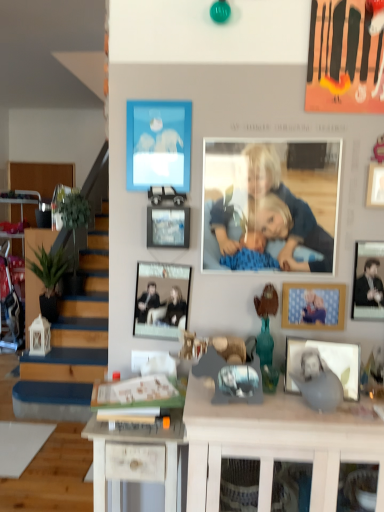
The image size is (384, 512). I want to click on white wood cabinet at lower left, so click(x=22, y=199).

What is the approximate width of matte silver picture frame at center, arranged as the fifth picture frame when viewed from the top?

matte silver picture frame at center, arranged as the fifth picture frame when viewed from the top, is 3.24 inches wide.

What do you see at coordinates (267, 337) in the screenshot?
I see `wooden bear at center` at bounding box center [267, 337].

This screenshot has height=512, width=384. Describe the element at coordinates (161, 298) in the screenshot. I see `matte black picture frame at center, marked as the third picture frame in a top-to-bottom arrangement` at that location.

Describe the element at coordinates (158, 144) in the screenshot. I see `matte blue picture frame at upper center, the first picture frame positioned from the top` at that location.

Locate an element on the screen. The image size is (384, 512). green matte plant at left is located at coordinates (49, 278).

The image size is (384, 512). I want to click on white wood desk at center, which ranks as the second desk in right-to-left order, so click(137, 459).

From the image's perspective, who appears lower, blue fabric at center or wooden picture frame at center-right, which appears as the 2th picture frame when ordered from the bottom?

From the image's view, wooden picture frame at center-right, which appears as the 2th picture frame when ordered from the bottom, is below.

Which is further, (x=313, y=168) or (x=295, y=327)?

The point (x=295, y=327) is behind.

Is blue fabric at center turned away from wooden picture frame at center-right, the 4th picture frame from the top?

That's not correct — blue fabric at center is not looking away from wooden picture frame at center-right, the 4th picture frame from the top.

Is wooden picture frame at center-right, the 4th picture frame from the top, a part of blue fabric at center?

No, wooden picture frame at center-right, the 4th picture frame from the top, is located outside of blue fabric at center.

Can you tell me how much white wood cabinet at lower left and white wood desk at center, acting as the first desk starting from the left, differ in facing direction?

The angle between the facing direction of white wood cabinet at lower left and the facing direction of white wood desk at center, acting as the first desk starting from the left, is 25.2 degrees.

From the image's perspective, is white wood cabinet at lower left located above or below white wood desk at center, acting as the first desk starting from the left?

Clearly, from the image's perspective, white wood cabinet at lower left is above white wood desk at center, acting as the first desk starting from the left.

Is point (22, 205) in front of point (174, 509)?

No, (22, 205) is further to viewer.

Who is taller, white wood cabinet at lower left or white wood desk at center, which ranks as the second desk in right-to-left order?

With more height is white wood cabinet at lower left.

Looking at this image, is white wood cabinet at lower left facing away from metallic black picture frame at center, the fourth picture frame in the bottom-to-top sequence?

No, white wood cabinet at lower left's orientation is not away from metallic black picture frame at center, the fourth picture frame in the bottom-to-top sequence.

Which point is more distant from viewer, (18, 202) or (155, 237)?

Positioned behind is point (18, 202).

What's the angular difference between white wood cabinet at lower left and metallic black picture frame at center, the fourth picture frame in the bottom-to-top sequence,'s facing directions?

The facing directions of white wood cabinet at lower left and metallic black picture frame at center, the fourth picture frame in the bottom-to-top sequence, are 24.7 degrees apart.

Considering the sizes of objects white wood cabinet at lower left and metallic black picture frame at center, the fourth picture frame in the bottom-to-top sequence, in the image provided, who is taller, white wood cabinet at lower left or metallic black picture frame at center, the fourth picture frame in the bottom-to-top sequence,?

white wood cabinet at lower left.

From the image's perspective, is white wood desk at center, which ranks as the second desk in right-to-left order, below blue fabric at center?

Correct, white wood desk at center, which ranks as the second desk in right-to-left order, appears lower than blue fabric at center in the image.

How different are the orientations of white wood desk at center, which ranks as the second desk in right-to-left order, and blue fabric at center in degrees?

The facing directions of white wood desk at center, which ranks as the second desk in right-to-left order, and blue fabric at center are 0.595 degrees apart.

The image size is (384, 512). What are the coordinates of `person above the white wood desk at center, acting as the first desk starting from the left (from the image's perspective)` in the screenshot? It's located at (271, 206).

Considering the sizes of matte blue picture frame at upper center, positioned as the 5th picture frame in bottom-to-top order, and green matte plant at left in the image, is matte blue picture frame at upper center, positioned as the 5th picture frame in bottom-to-top order, taller or shorter than green matte plant at left?

matte blue picture frame at upper center, positioned as the 5th picture frame in bottom-to-top order, is shorter than green matte plant at left.

Does point (167, 156) come behind point (41, 260)?

No, it is not.

From the image's perspective, between matte blue picture frame at upper center, the first picture frame positioned from the top, and green matte plant at left, who is located below?

From the image's view, green matte plant at left is below.

Is matte blue picture frame at upper center, the first picture frame positioned from the top, oriented away from green matte plant at left?

No, matte blue picture frame at upper center, the first picture frame positioned from the top, is not facing away from green matte plant at left.

Locate an element on the screen. picture frame positioned vertically above the metallic black picture frame at center, the fourth picture frame in the bottom-to-top sequence (from a real-world perspective) is located at coordinates (158, 144).

Which object is closer to the camera taking this photo, matte blue picture frame at upper center, positioned as the 5th picture frame in bottom-to-top order, or metallic black picture frame at center, which is the second picture frame in top-to-bottom order?

metallic black picture frame at center, which is the second picture frame in top-to-bottom order, is closer to the camera.

Considering the relative sizes of matte blue picture frame at upper center, the first picture frame positioned from the top, and metallic black picture frame at center, which is the second picture frame in top-to-bottom order, in the image provided, is matte blue picture frame at upper center, the first picture frame positioned from the top, thinner than metallic black picture frame at center, which is the second picture frame in top-to-bottom order,?

Yes, matte blue picture frame at upper center, the first picture frame positioned from the top, is thinner than metallic black picture frame at center, which is the second picture frame in top-to-bottom order.

Between matte blue picture frame at upper center, positioned as the 5th picture frame in bottom-to-top order, and metallic black picture frame at center, which is the second picture frame in top-to-bottom order, which one appears on the right side from the viewer's perspective?

From the viewer's perspective, metallic black picture frame at center, which is the second picture frame in top-to-bottom order, appears more on the right side.

How far apart are matte black picture frame at center, the third picture frame positioned from the bottom, and green matte plant at left?

matte black picture frame at center, the third picture frame positioned from the bottom, and green matte plant at left are 7.26 feet apart.

From the image's perspective, which one is positioned lower, matte black picture frame at center, the third picture frame positioned from the bottom, or green matte plant at left?

green matte plant at left.

Is matte black picture frame at center, marked as the third picture frame in a top-to-bottom arrangement, oriented towards green matte plant at left?

No, matte black picture frame at center, marked as the third picture frame in a top-to-bottom arrangement, is not aimed at green matte plant at left.

Do you think matte black picture frame at center, the third picture frame positioned from the bottom, is within green matte plant at left, or outside of it?

matte black picture frame at center, the third picture frame positioned from the bottom, is not inside green matte plant at left, it's outside.

Identify the location of person on the left side of wooden picture frame at center-right, which appears as the 2th picture frame when ordered from the bottom. (271, 206).

The width and height of the screenshot is (384, 512). I want to click on desk that is the 2nd one when counting downward from the white wood cabinet at lower left (from the image's perspective), so click(x=137, y=459).

Estimate the real-world distances between objects in this image. Which object is further from wooden picture frame at center-right, the 4th picture frame from the top, green matte plant at left or wooden bear at center?

green matte plant at left.

Consider the image. Estimate the real-world distances between objects in this image. Which object is further from white wood desk at center, which ranks as the second desk in right-to-left order, matte silver picture frame at center, the first picture frame from the bottom, or white wood desk at center, positioned as the first desk in right-to-left order?

The object further to white wood desk at center, which ranks as the second desk in right-to-left order, is matte silver picture frame at center, the first picture frame from the bottom.

Considering their positions, is matte silver picture frame at center, arranged as the fifth picture frame when viewed from the top, positioned further to blue fabric at center than white wood desk at center, acting as the first desk starting from the left?

white wood desk at center, acting as the first desk starting from the left, lies further to blue fabric at center than the other object.

Estimate the real-world distances between objects in this image. Which object is closer to white wood desk at center, the 2th desk viewed from the left, metallic black picture frame at center, which is the second picture frame in top-to-bottom order, or white wood desk at center, which ranks as the second desk in right-to-left order?

white wood desk at center, which ranks as the second desk in right-to-left order, is closer to white wood desk at center, the 2th desk viewed from the left.

Consider the image. When comparing their distances from white wood desk at center, acting as the first desk starting from the left, does white wood cabinet at lower left or matte silver picture frame at center, the first picture frame from the bottom, seem further?

white wood cabinet at lower left is positioned further to the anchor white wood desk at center, acting as the first desk starting from the left.

From the image, which object appears to be farther from white wood cabinet at lower left, wooden bear at center or matte blue picture frame at upper center, the first picture frame positioned from the top?

Based on the image, wooden bear at center appears to be further to white wood cabinet at lower left.

From the image, which object appears to be nearer to blue fabric at center, white wood desk at center, acting as the first desk starting from the left, or matte silver picture frame at center, arranged as the fifth picture frame when viewed from the top?

matte silver picture frame at center, arranged as the fifth picture frame when viewed from the top, is positioned closer to the anchor blue fabric at center.

Looking at the image, which one is located further to wooden picture frame at center-right, which appears as the 2th picture frame when ordered from the bottom, metallic black picture frame at center, which is the second picture frame in top-to-bottom order, or white wood desk at center, the 2th desk viewed from the left?

metallic black picture frame at center, which is the second picture frame in top-to-bottom order, is positioned further to the anchor wooden picture frame at center-right, which appears as the 2th picture frame when ordered from the bottom.

Where is `toy that lies between blue fabric at center and white wood desk at center, the 2th desk viewed from the left, from top to bottom`? toy that lies between blue fabric at center and white wood desk at center, the 2th desk viewed from the left, from top to bottom is located at coordinates (267, 337).

Where is `toy between white wood desk at center, the 2th desk viewed from the left, and green matte plant at left from front to back`? toy between white wood desk at center, the 2th desk viewed from the left, and green matte plant at left from front to back is located at coordinates (267, 337).

Locate an element on the screen. The height and width of the screenshot is (512, 384). desk located between matte black picture frame at center, marked as the third picture frame in a top-to-bottom arrangement, and matte silver picture frame at center, the first picture frame from the bottom, in the left-right direction is located at coordinates (277, 442).

Locate an element on the screen. This screenshot has width=384, height=512. toy between metallic black picture frame at center, the fourth picture frame in the bottom-to-top sequence, and white wood desk at center, positioned as the first desk in right-to-left order, from top to bottom is located at coordinates click(267, 337).